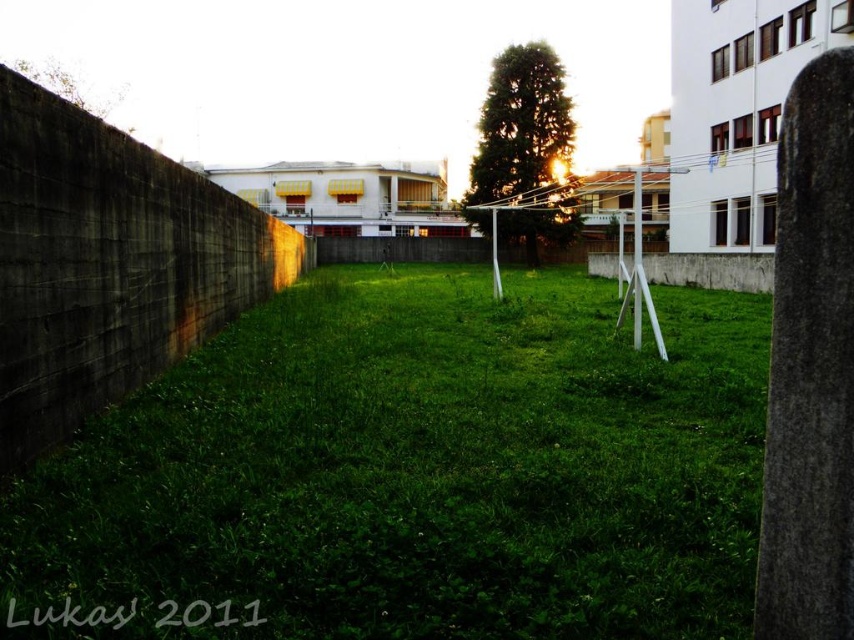
Question: Can you confirm if green grassy at center is positioned below gray concrete wall at left?

Choices:
 (A) yes
 (B) no

Answer: (A)

Question: Does green grassy at center have a smaller size compared to gray concrete wall at left?

Choices:
 (A) yes
 (B) no

Answer: (A)

Question: Is green grassy at center bigger than gray concrete wall at left?

Choices:
 (A) yes
 (B) no

Answer: (B)

Question: Which object appears closest to the camera in this image?

Choices:
 (A) green grassy at center
 (B) gray concrete wall at left

Answer: (A)